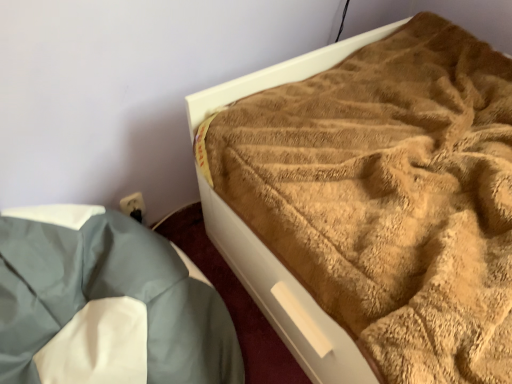
This screenshot has height=384, width=512. What do you see at coordinates (106, 303) in the screenshot?
I see `light blue fabric at lower left` at bounding box center [106, 303].

What is the approximate width of light blue fabric at lower left?

It is 31.04 inches.

At what (x,y) coordinates should I click in order to perform the action: click on light blue fabric at lower left. Please return your answer as a coordinate pair (x, y). This screenshot has width=512, height=384. Looking at the image, I should click on (106, 303).

What is the approximate height of brown fuzzy blanket at upper right?

The height of brown fuzzy blanket at upper right is 12.00 inches.

This screenshot has height=384, width=512. Identify the location of brown fuzzy blanket at upper right. pyautogui.click(x=378, y=204).

What do you see at coordinates (378, 204) in the screenshot? I see `brown fuzzy blanket at upper right` at bounding box center [378, 204].

I want to click on light blue fabric at lower left, so click(x=106, y=303).

Based on the photo, is light blue fabric at lower left to the left or to the right of brown fuzzy blanket at upper right in the image?

light blue fabric at lower left is to the left of brown fuzzy blanket at upper right.

Based on the photo, considering the positions of objects light blue fabric at lower left and brown fuzzy blanket at upper right in the image provided, who is in front, light blue fabric at lower left or brown fuzzy blanket at upper right?

Positioned in front is light blue fabric at lower left.

Is point (214, 369) farther from camera compared to point (213, 105)?

No, it is not.

From the image's perspective, is light blue fabric at lower left under brown fuzzy blanket at upper right?

Correct, light blue fabric at lower left appears lower than brown fuzzy blanket at upper right in the image.

Looking at this image, from a real-world perspective, is light blue fabric at lower left physically located above or below brown fuzzy blanket at upper right?

In terms of real-world spatial position, light blue fabric at lower left is below brown fuzzy blanket at upper right.

Considering the sizes of light blue fabric at lower left and brown fuzzy blanket at upper right in the image, is light blue fabric at lower left wider or thinner than brown fuzzy blanket at upper right?

Considering their sizes, light blue fabric at lower left looks slimmer than brown fuzzy blanket at upper right.

Looking at this image, who is shorter, light blue fabric at lower left or brown fuzzy blanket at upper right?

brown fuzzy blanket at upper right.

Which of these two, light blue fabric at lower left or brown fuzzy blanket at upper right, is bigger?

With larger size is brown fuzzy blanket at upper right.

Which is correct: light blue fabric at lower left is inside brown fuzzy blanket at upper right, or outside of it?

light blue fabric at lower left exists outside the volume of brown fuzzy blanket at upper right.

Is light blue fabric at lower left next to brown fuzzy blanket at upper right and touching it?

light blue fabric at lower left and brown fuzzy blanket at upper right are clearly separated.

Is light blue fabric at lower left facing towards brown fuzzy blanket at upper right?

No, light blue fabric at lower left is not facing towards brown fuzzy blanket at upper right.

How distant is light blue fabric at lower left from brown fuzzy blanket at upper right?

18.02 inches.

Locate an element on the screen. The image size is (512, 384). bedding that appears on the left of brown fuzzy blanket at upper right is located at coordinates (106, 303).

Is brown fuzzy blanket at upper right to the left of light blue fabric at lower left from the viewer's perspective?

In fact, brown fuzzy blanket at upper right is to the right of light blue fabric at lower left.

Which is in front, brown fuzzy blanket at upper right or light blue fabric at lower left?

light blue fabric at lower left is more forward.

Which point is more forward, (454,279) or (0,217)?

The point (454,279) is closer.

From the image's perspective, is brown fuzzy blanket at upper right beneath light blue fabric at lower left?

Incorrect, from the image's perspective, brown fuzzy blanket at upper right is higher than light blue fabric at lower left.

From a real-world perspective, is brown fuzzy blanket at upper right located beneath light blue fabric at lower left?

No.

Can you confirm if brown fuzzy blanket at upper right is wider than light blue fabric at lower left?

Correct, the width of brown fuzzy blanket at upper right exceeds that of light blue fabric at lower left.

Is brown fuzzy blanket at upper right shorter than light blue fabric at lower left?

Yes.

Which of these two, brown fuzzy blanket at upper right or light blue fabric at lower left, is smaller?

With smaller size is light blue fabric at lower left.

Is brown fuzzy blanket at upper right inside or outside of light blue fabric at lower left?

brown fuzzy blanket at upper right is located beyond the bounds of light blue fabric at lower left.

Is brown fuzzy blanket at upper right placed right next to light blue fabric at lower left?

They are not placed beside each other.

Consider the image. Is brown fuzzy blanket at upper right positioned with its back to light blue fabric at lower left?

brown fuzzy blanket at upper right is not turned away from light blue fabric at lower left.

This screenshot has height=384, width=512. There is a light blue fabric at lower left. Find the location of `bed above it (from a real-world perspective)`. bed above it (from a real-world perspective) is located at coordinates (378, 204).

I want to click on bed above the light blue fabric at lower left (from a real-world perspective), so click(x=378, y=204).

Find the location of `bedding in front of the brown fuzzy blanket at upper right`. bedding in front of the brown fuzzy blanket at upper right is located at coordinates (106, 303).